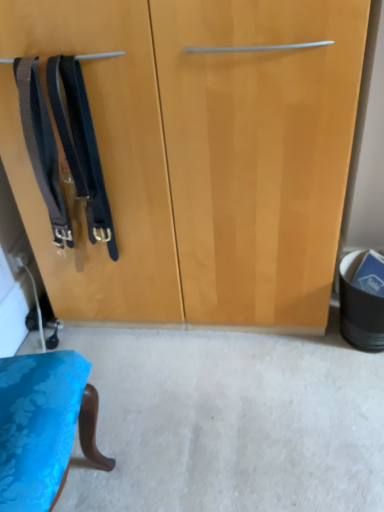
Question: Does black matte suspenders at left, which is the 1th suspenders in right-to-left order, have a larger size compared to black leather suspenders at left, positioned as the 1th suspenders in left-to-right order?

Choices:
 (A) no
 (B) yes

Answer: (B)

Question: From a real-world perspective, is black matte suspenders at left, the 2th suspenders positioned from the left, over black leather suspenders at left, positioned as the 1th suspenders in left-to-right order?

Choices:
 (A) no
 (B) yes

Answer: (A)

Question: Can you confirm if black matte suspenders at left, which is the 1th suspenders in right-to-left order, is shorter than black leather suspenders at left, which is the second suspenders in right-to-left order?

Choices:
 (A) no
 (B) yes

Answer: (A)

Question: Is black matte suspenders at left, the 2th suspenders positioned from the left, far away from black leather suspenders at left, which is the second suspenders in right-to-left order?

Choices:
 (A) no
 (B) yes

Answer: (A)

Question: Does black matte suspenders at left, the 2th suspenders positioned from the left, have a lesser width compared to black leather suspenders at left, positioned as the 1th suspenders in left-to-right order?

Choices:
 (A) no
 (B) yes

Answer: (A)

Question: From a real-world perspective, is black matte suspenders at left, which is the 1th suspenders in right-to-left order, under black leather suspenders at left, which is the second suspenders in right-to-left order?

Choices:
 (A) no
 (B) yes

Answer: (B)

Question: Considering the relative sizes of black leather suspenders at left, positioned as the 1th suspenders in left-to-right order, and black matte suspenders at left, the 2th suspenders positioned from the left, in the image provided, is black leather suspenders at left, positioned as the 1th suspenders in left-to-right order, bigger than black matte suspenders at left, the 2th suspenders positioned from the left,?

Choices:
 (A) yes
 (B) no

Answer: (B)

Question: From the image's perspective, would you say black leather suspenders at left, positioned as the 1th suspenders in left-to-right order, is positioned over black matte suspenders at left, the 2th suspenders positioned from the left?

Choices:
 (A) no
 (B) yes

Answer: (B)

Question: Could you tell me if black leather suspenders at left, positioned as the 1th suspenders in left-to-right order, is facing black matte suspenders at left, the 2th suspenders positioned from the left?

Choices:
 (A) yes
 (B) no

Answer: (B)

Question: Is black leather suspenders at left, positioned as the 1th suspenders in left-to-right order, wider than black matte suspenders at left, which is the 1th suspenders in right-to-left order?

Choices:
 (A) no
 (B) yes

Answer: (A)

Question: Are black leather suspenders at left, which is the second suspenders in right-to-left order, and black matte suspenders at left, which is the 1th suspenders in right-to-left order, far apart?

Choices:
 (A) no
 (B) yes

Answer: (A)

Question: Can you confirm if black leather suspenders at left, positioned as the 1th suspenders in left-to-right order, is thinner than black matte suspenders at left, which is the 1th suspenders in right-to-left order?

Choices:
 (A) no
 (B) yes

Answer: (B)

Question: Is point (33, 89) closer or farther from the camera than point (51, 64)?

Choices:
 (A) farther
 (B) closer

Answer: (B)